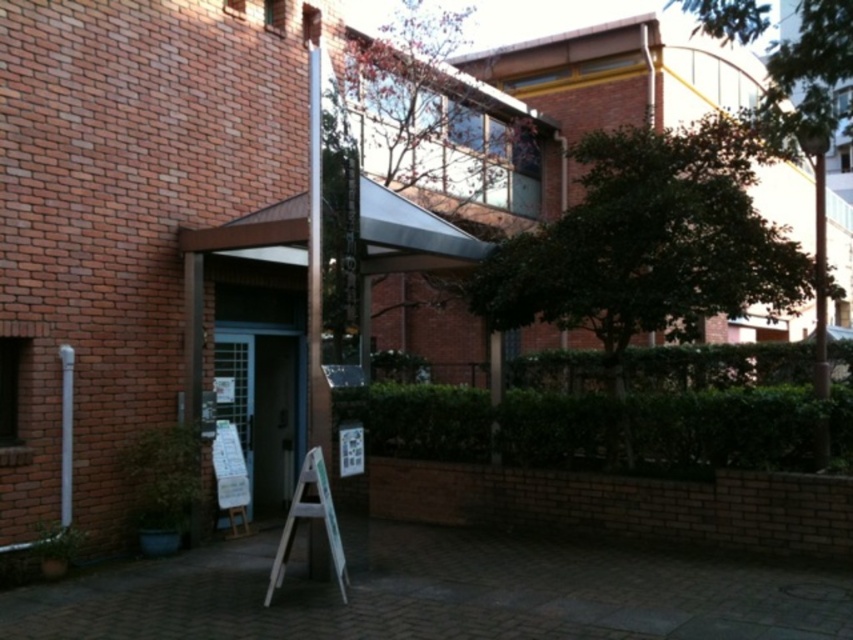
Question: Which point is farther to the camera?

Choices:
 (A) white wood ladder at center
 (B) silver metallic pole at center
 (C) white paper sign at center

Answer: (C)

Question: Which object is farther from the camera taking this photo?

Choices:
 (A) white paper sign at center
 (B) white wood ladder at center

Answer: (A)

Question: Which point is farther from the camera taking this photo?

Choices:
 (A) (340, 445)
 (B) (328, 508)
 (C) (310, 536)

Answer: (C)

Question: Considering the relative positions of white wood ladder at center and white paper sign at center in the image provided, where is white wood ladder at center located with respect to white paper sign at center?

Choices:
 (A) right
 (B) left

Answer: (B)

Question: Does silver metallic pole at center have a greater width compared to white paper sign at center?

Choices:
 (A) yes
 (B) no

Answer: (B)

Question: From the image, what is the correct spatial relationship of silver metallic pole at center in relation to white wood ladder at center?

Choices:
 (A) left
 (B) right

Answer: (A)